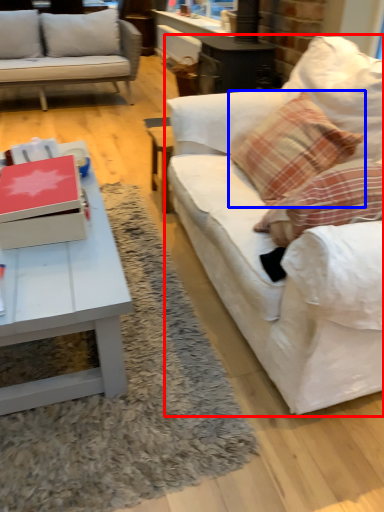
Question: Which object appears farthest to the camera in this image, studio couch (highlighted by a red box) or pillow (highlighted by a blue box)?

Choices:
 (A) studio couch
 (B) pillow

Answer: (B)